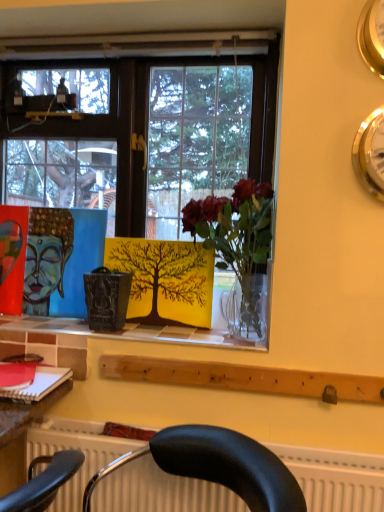
Question: From a real-world perspective, is gold metallic clock at upper right, marked as the 2th clock in a top-to-bottom arrangement, positioned under matte red book at lower left based on gravity?

Choices:
 (A) no
 (B) yes

Answer: (A)

Question: Does gold metallic clock at upper right, the 1th clock when ordered from bottom to top, have a greater width compared to matte red book at lower left?

Choices:
 (A) yes
 (B) no

Answer: (B)

Question: Is gold metallic clock at upper right, marked as the 2th clock in a top-to-bottom arrangement, not close to matte red book at lower left?

Choices:
 (A) no
 (B) yes

Answer: (B)

Question: Is matte red book at lower left a part of gold metallic clock at upper right, the 1th clock when ordered from bottom to top?

Choices:
 (A) yes
 (B) no

Answer: (B)

Question: Can you confirm if gold metallic clock at upper right, the 1th clock when ordered from bottom to top, is positioned to the left of matte red book at lower left?

Choices:
 (A) yes
 (B) no

Answer: (B)

Question: From their relative heights in the image, would you say yellow matte tree at center is taller or shorter than gold metallic clock at upper right, marked as the 2th clock in a top-to-bottom arrangement?

Choices:
 (A) short
 (B) tall

Answer: (B)

Question: Considering the positions of yellow matte tree at center and gold metallic clock at upper right, the 1th clock when ordered from bottom to top, in the image, is yellow matte tree at center bigger or smaller than gold metallic clock at upper right, the 1th clock when ordered from bottom to top,?

Choices:
 (A) big
 (B) small

Answer: (A)

Question: Considering the relative positions of yellow matte tree at center and gold metallic clock at upper right, marked as the 2th clock in a top-to-bottom arrangement, in the image provided, is yellow matte tree at center to the left or to the right of gold metallic clock at upper right, marked as the 2th clock in a top-to-bottom arrangement,?

Choices:
 (A) right
 (B) left

Answer: (B)

Question: Relative to gold metallic clock at upper right, marked as the 2th clock in a top-to-bottom arrangement, is yellow matte tree at center in front or behind?

Choices:
 (A) behind
 (B) front

Answer: (A)

Question: Would you say matte red book at lower left is to the left or to the right of translucent glass vase at center in the picture?

Choices:
 (A) right
 (B) left

Answer: (B)

Question: From their relative heights in the image, would you say matte red book at lower left is taller or shorter than translucent glass vase at center?

Choices:
 (A) short
 (B) tall

Answer: (A)

Question: From a real-world perspective, is matte red book at lower left above or below translucent glass vase at center?

Choices:
 (A) below
 (B) above

Answer: (A)

Question: From the image's perspective, relative to translucent glass vase at center, is matte red book at lower left above or below?

Choices:
 (A) below
 (B) above

Answer: (A)

Question: Considering their positions, is yellow matte tree at center located in front of or behind white tile at center?

Choices:
 (A) behind
 (B) front

Answer: (A)

Question: Considering the positions of yellow matte tree at center and white tile at center in the image, is yellow matte tree at center taller or shorter than white tile at center?

Choices:
 (A) short
 (B) tall

Answer: (B)